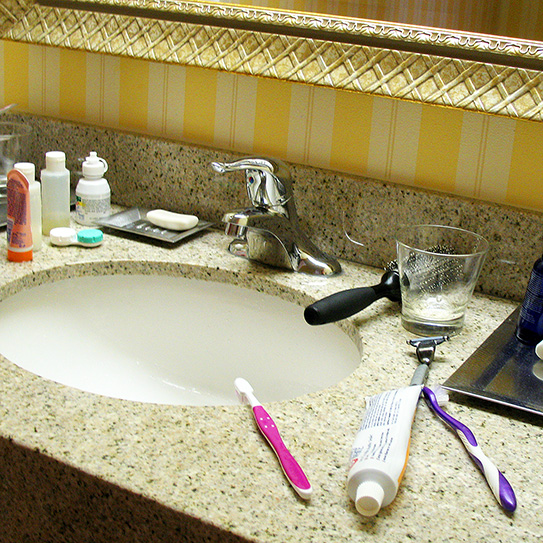
At what (x,y) coordinates should I click in order to perform the action: click on white ceramic sink. Please return your answer as a coordinate pair (x, y). This screenshot has height=543, width=543. Looking at the image, I should click on (184, 378).